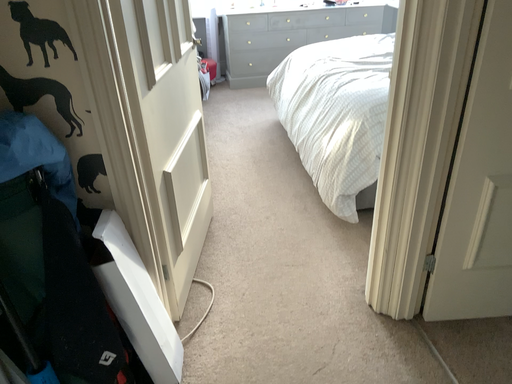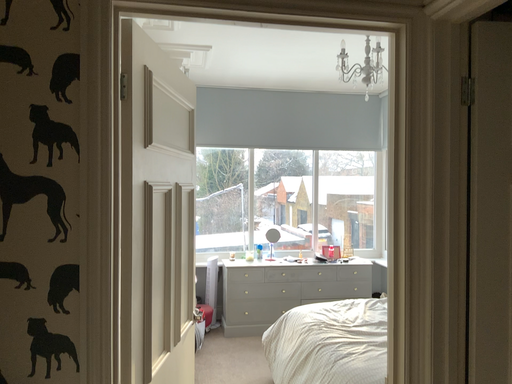
Question: Which way did the camera rotate in the video?

Choices:
 (A) rotated downward
 (B) rotated upward

Answer: (B)